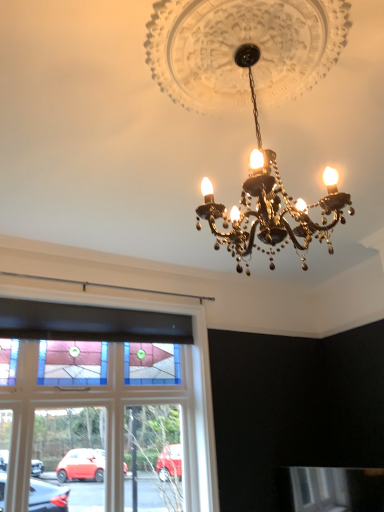
Question: From a real-world perspective, is stained glass window at center positioned above or below gold metallic chandelier at center?

Choices:
 (A) below
 (B) above

Answer: (A)

Question: Considering their positions, is stained glass window at center located in front of or behind gold metallic chandelier at center?

Choices:
 (A) front
 (B) behind

Answer: (B)

Question: Visually, is stained glass window at center positioned to the left or to the right of gold metallic chandelier at center?

Choices:
 (A) right
 (B) left

Answer: (B)

Question: Is gold metallic chandelier at center to the left or to the right of stained glass window at center in the image?

Choices:
 (A) right
 (B) left

Answer: (A)

Question: From a real-world perspective, is gold metallic chandelier at center above or below stained glass window at center?

Choices:
 (A) above
 (B) below

Answer: (A)

Question: Relative to stained glass window at center, is gold metallic chandelier at center in front or behind?

Choices:
 (A) behind
 (B) front

Answer: (B)

Question: From the image's perspective, is gold metallic chandelier at center located above or below stained glass window at center?

Choices:
 (A) below
 (B) above

Answer: (B)